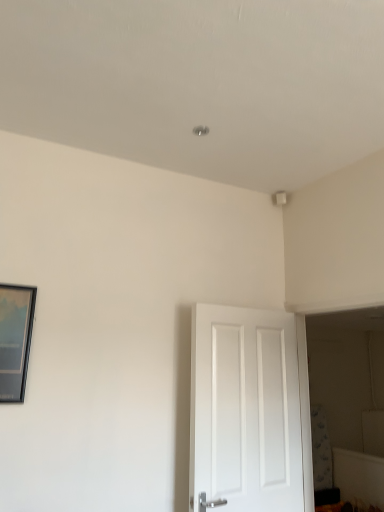
At what (x,y) coordinates should I click in order to perform the action: click on white smooth door at center. Please return your answer as a coordinate pair (x, y). Looking at the image, I should click on (249, 409).

What do you see at coordinates (249, 409) in the screenshot? This screenshot has width=384, height=512. I see `white smooth door at center` at bounding box center [249, 409].

What is the approximate height of white smooth door at center?

It is 4.00 feet.

You are a GUI agent. You are given a task and a screenshot of the screen. Output one action in this format:
    pyautogui.click(x=<x>, y=<y>)
    Task: Click on the white smooth door at center
    The image size is (384, 512).
    Given the screenshot: What is the action you would take?
    pyautogui.click(x=249, y=409)